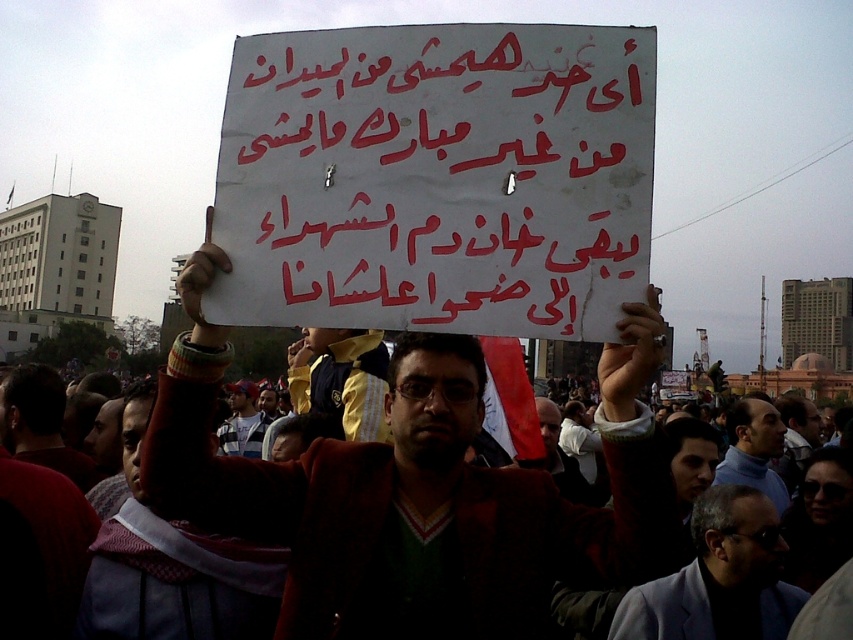
In the protest scene, you notice a white paper placard at center and a gray fabric jacket at center. Which object is wider?

The white paper placard at center is wider than the gray fabric jacket at center.

You are a photographer standing at the edge of a protest crowd. You want to take a photo of the dark brown jacket at center while also capturing the sign with Arabic text in the background. Can you fit both subjects in the frame if your camera has a 50mm lens?

The dark brown jacket at center and the sign with Arabic text are 24.97 meters apart. With a 50mm lens, which has a standard field of view similar to human vision, it might be challenging to capture both subjects at such a distance in a single frame without zooming in, which could blur details. Consider moving closer or using a wider lens for better framing.

You are a photographer standing in front of the protest scene. You want to take a photo that includes both the white paper placard at center and the gray fabric jacket at center. Based on their positions, which object should appear higher in the photo?

The white paper placard at center is located above the gray fabric jacket at center, so it will appear higher in the photo.